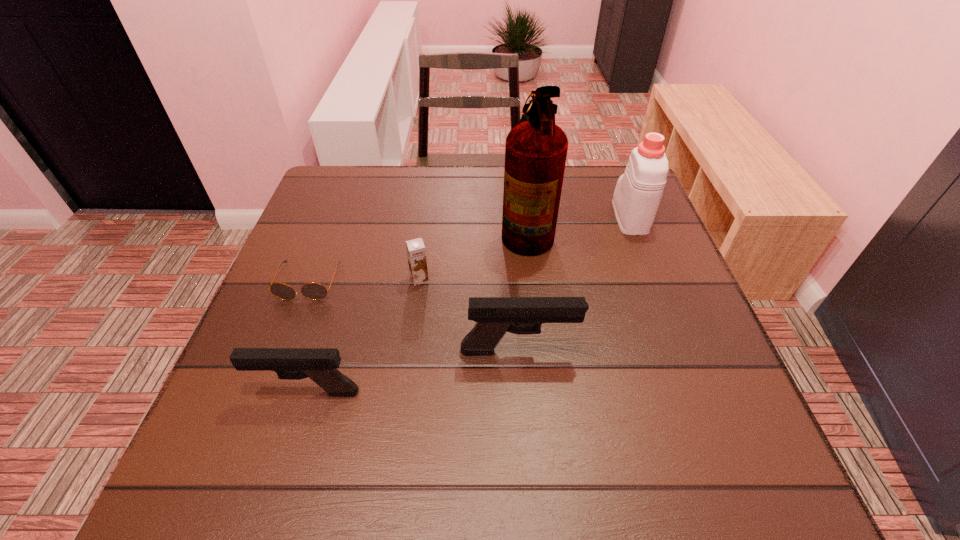
Identify the location of the nearer pistol. (319, 364).

What are the coordinates of `the nearest object` in the screenshot? It's located at (319, 364).

Identify the location of the fifth farthest object. This screenshot has height=540, width=960. (495, 316).

The width and height of the screenshot is (960, 540). Find the location of `the farther pistol`. the farther pistol is located at coordinates (495, 316).

Find the location of a particular element. This screenshot has width=960, height=540. the tallest object is located at coordinates (536, 149).

The image size is (960, 540). What are the coordinates of `detergent` in the screenshot? It's located at (638, 192).

Locate an element on the screen. The width and height of the screenshot is (960, 540). the rightmost object is located at coordinates (638, 192).

Identify the location of the shortest object. (314, 291).

This screenshot has height=540, width=960. In order to click on chocolate milk in this screenshot , I will do `click(415, 248)`.

This screenshot has height=540, width=960. I want to click on vacant space located 0.080m on the front-facing side of the taller pistol, so click(618, 351).